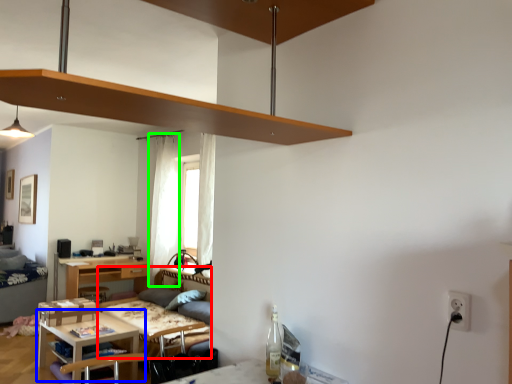
Question: Estimate the real-world distances between objects in this image. Which object is farther from couch (highlighted by a red box), table (highlighted by a blue box) or curtain (highlighted by a green box)?

Choices:
 (A) table
 (B) curtain

Answer: (B)